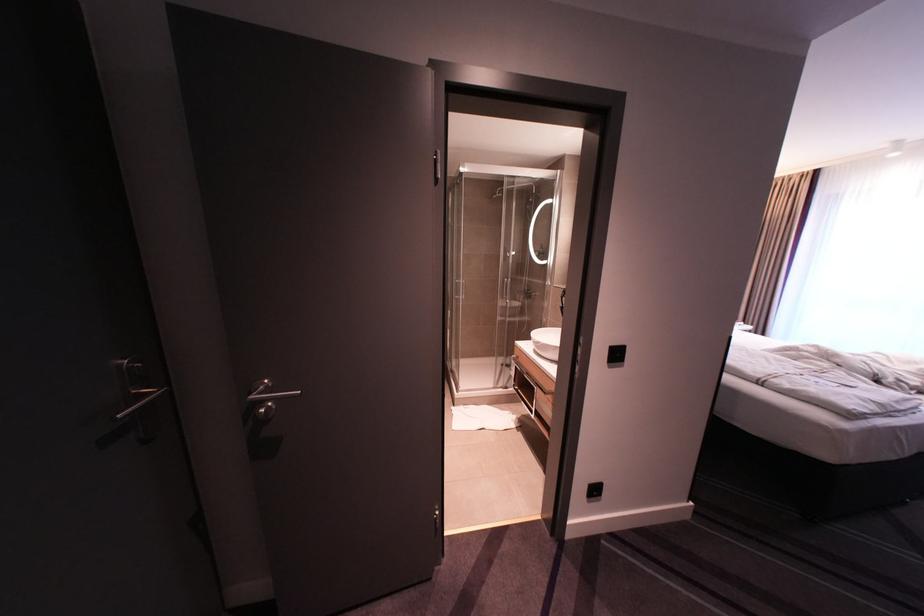
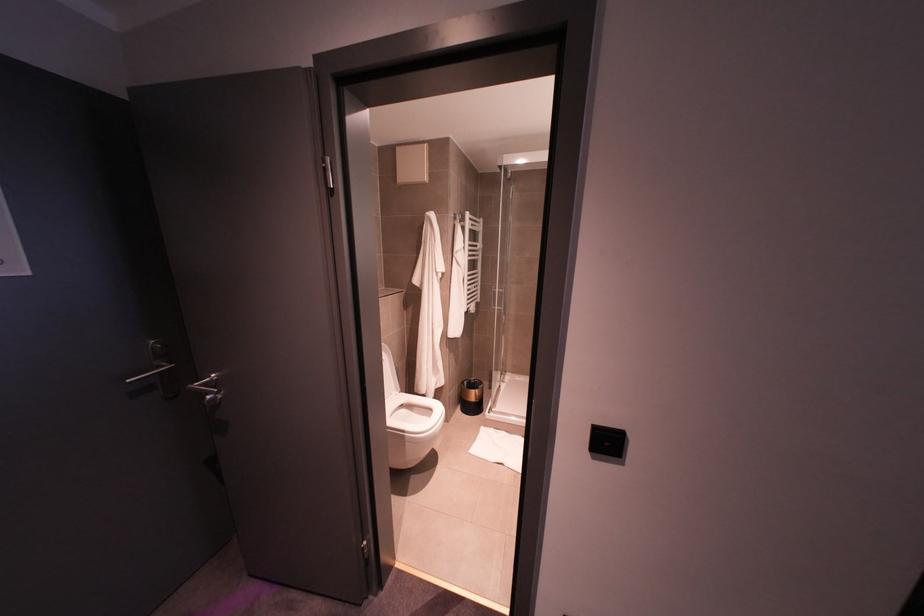
In the second image, find the point that corresponds to [615,354] in the first image.

(606, 442)